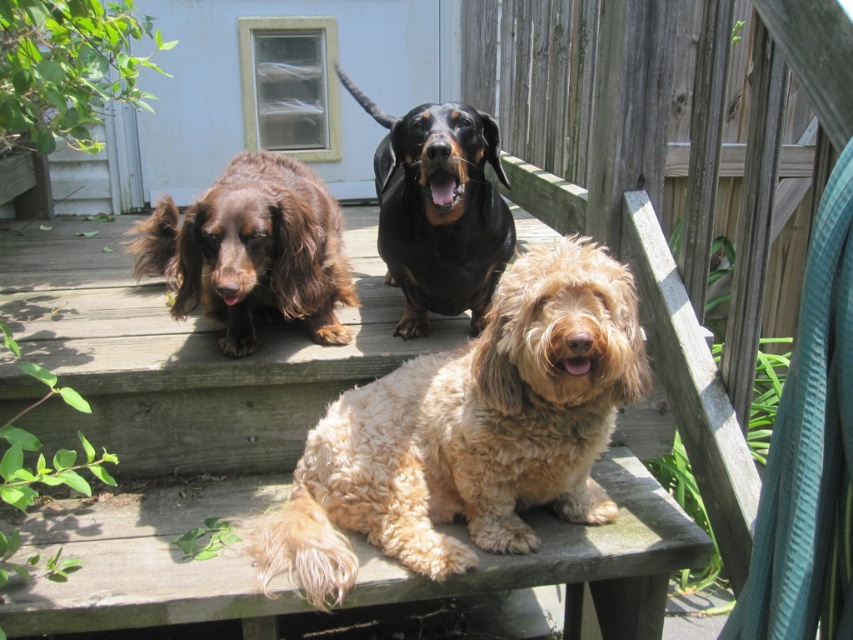
You are standing on the wooden deck and want to place a small plant pot between the two points marked as point (350, 436) and point (410, 323). Which point should the pot be closer to in order to be nearer to the foreground dog?

The pot should be placed closer to point (350, 436) because it is closer to the viewer, aligning it nearer to the foreground dog.